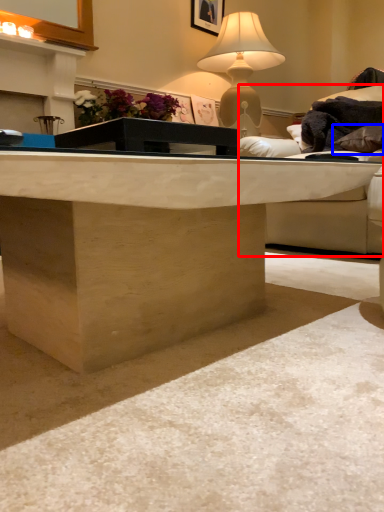
Question: Which of the following is the closest to the observer, studio couch (highlighted by a red box) or pillow (highlighted by a blue box)?

Choices:
 (A) studio couch
 (B) pillow

Answer: (A)